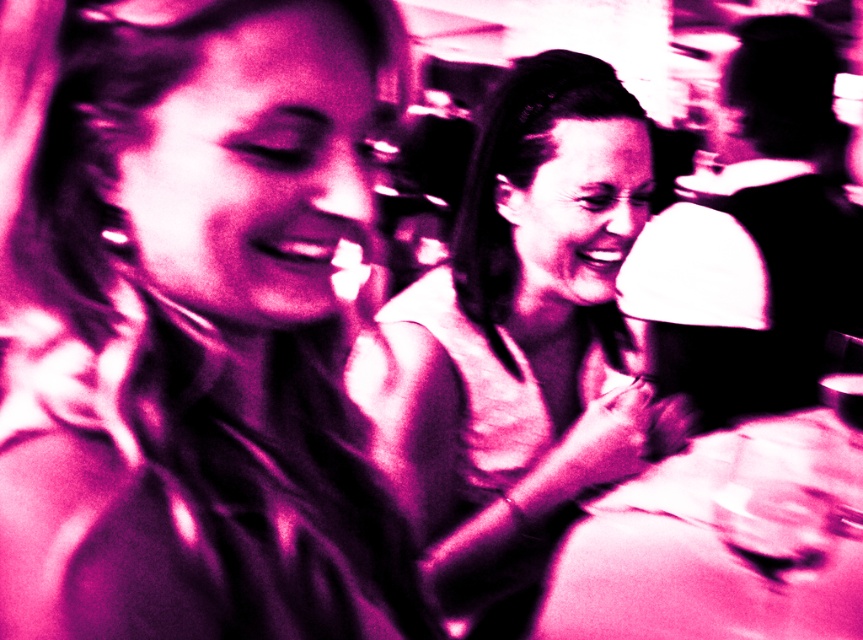
Question: Estimate the real-world distances between objects in this image. Which object is closer to the matte pink shirt at upper left?

Choices:
 (A) transparent plastic wine glass at lower right
 (B) matte white blouse at center

Answer: (B)

Question: Does matte pink shirt at upper left have a larger size compared to transparent plastic wine glass at lower right?

Choices:
 (A) yes
 (B) no

Answer: (B)

Question: Which object is the farthest from the matte white blouse at center?

Choices:
 (A) transparent plastic wine glass at lower right
 (B) matte pink shirt at upper left

Answer: (B)

Question: Estimate the real-world distances between objects in this image. Which object is closer to the matte pink shirt at upper left?

Choices:
 (A) transparent plastic wine glass at lower right
 (B) matte white blouse at center

Answer: (B)

Question: Is matte white blouse at center to the right of transparent plastic wine glass at lower right from the viewer's perspective?

Choices:
 (A) yes
 (B) no

Answer: (B)

Question: Is matte white blouse at center above transparent plastic wine glass at lower right?

Choices:
 (A) no
 (B) yes

Answer: (B)